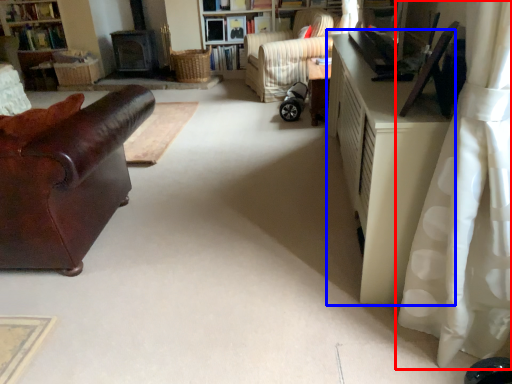
Question: Which object is further to the camera taking this photo, curtain (highlighted by a red box) or cabinetry (highlighted by a blue box)?

Choices:
 (A) curtain
 (B) cabinetry

Answer: (B)